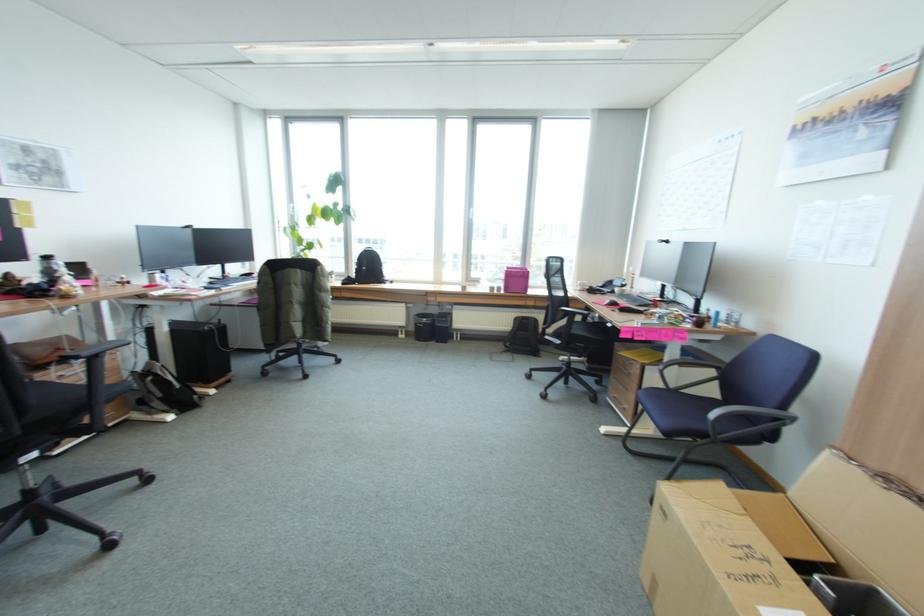
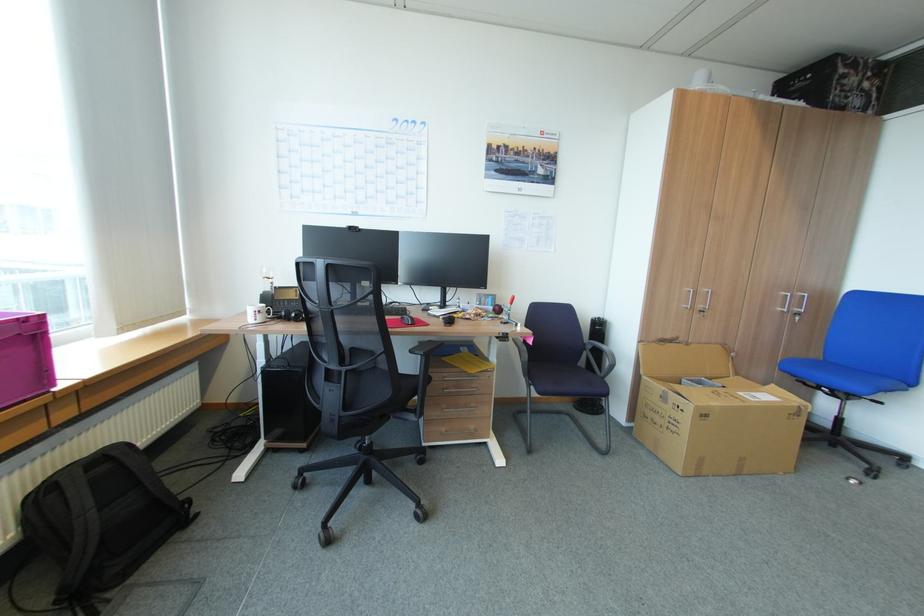
The point at (x=523, y=330) is marked in the first image. Where is the corresponding point in the second image?

(103, 511)